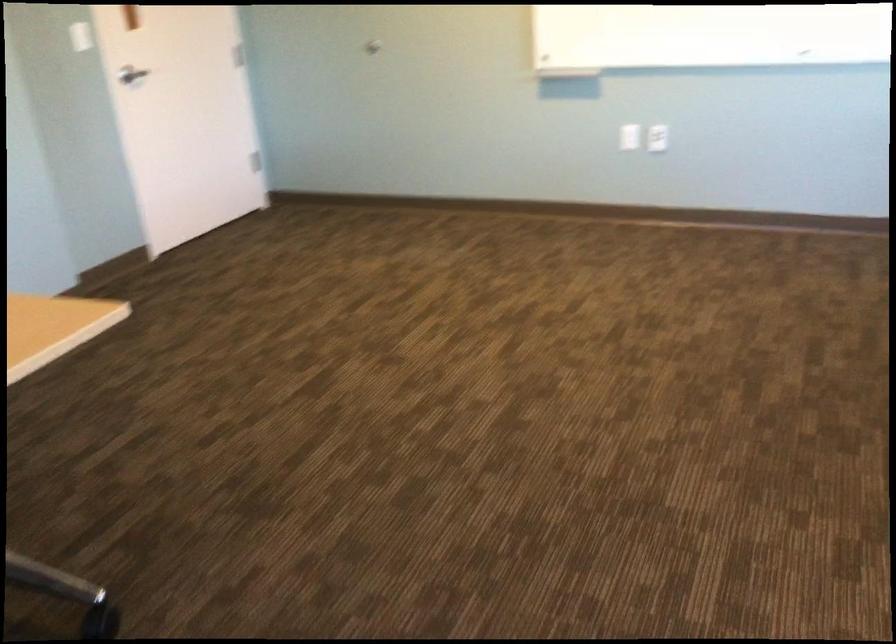
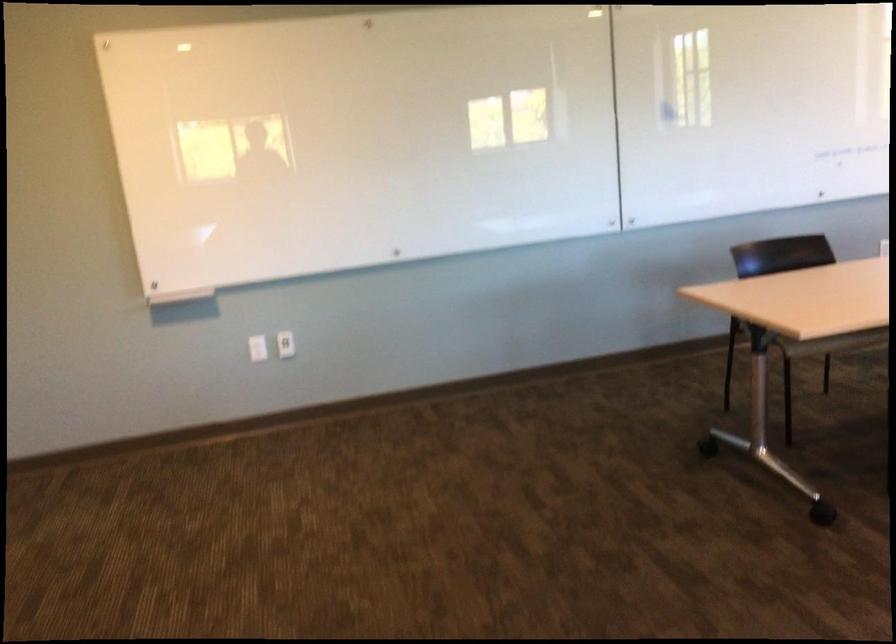
Question: The camera is either moving clockwise (left) or counter-clockwise (right) around the object. The first image is from the beginning of the video and the second image is from the end. Is the camera moving left or right when shooting the video?

Choices:
 (A) Left
 (B) Right

Answer: (A)